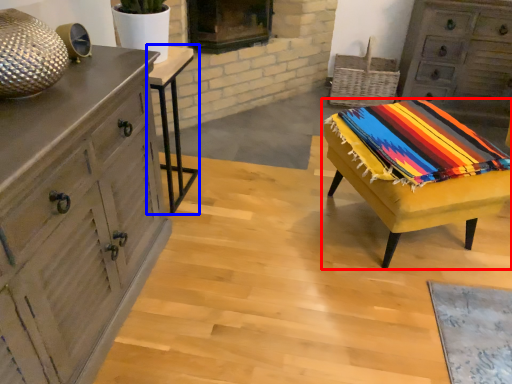
Question: Which point is further to the camera, table (highlighted by a red box) or table (highlighted by a blue box)?

Choices:
 (A) table
 (B) table

Answer: (B)